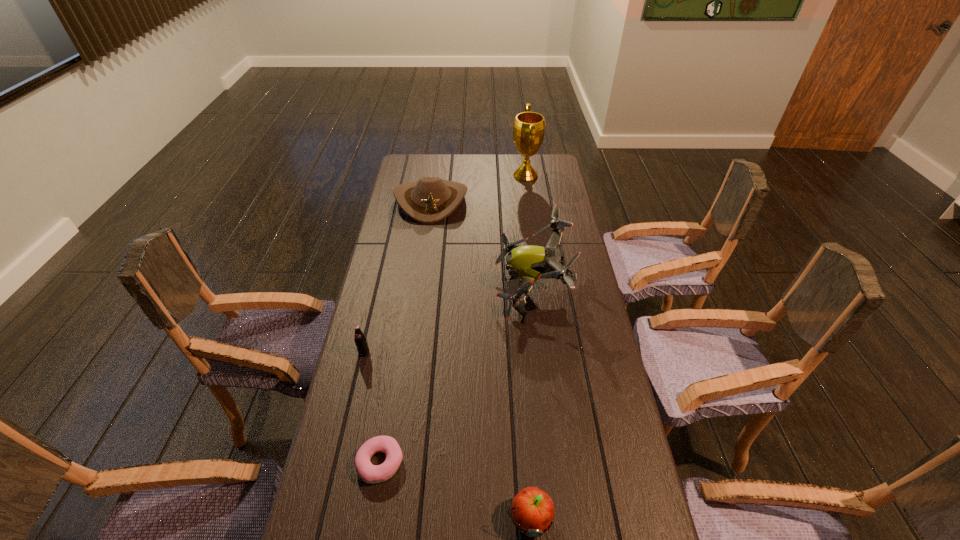
This screenshot has height=540, width=960. I want to click on free spot between the cowboy hat and the pop, so click(x=397, y=276).

The height and width of the screenshot is (540, 960). I want to click on vacant space that's between the award and the pop, so click(444, 264).

I want to click on free space between the cowboy hat and the tallest object, so click(478, 188).

Where is `free space between the pop and the shortest object`? free space between the pop and the shortest object is located at coordinates (372, 408).

What are the coordinates of `free space between the award and the second nearest object` in the screenshot? It's located at (453, 319).

Locate an element on the screen. Image resolution: width=960 pixels, height=540 pixels. the closest object to the cowboy hat is located at coordinates (529, 263).

Choose which object is the fourth nearest neighbor to the nearest object. Please provide its 2D coordinates. Your answer should be formatted as a tuple, i.e. [(x, y)], where the tuple contains the x and y coordinates of a point satisfying the conditions above.

[(430, 200)]

Where is `free space that satisfies the following two spatial constraints: 1. on the front label of the fourth farthest object; 2. on the right side of the pastry`? free space that satisfies the following two spatial constraints: 1. on the front label of the fourth farthest object; 2. on the right side of the pastry is located at coordinates (339, 463).

In order to click on free location that satisfies the following two spatial constraints: 1. on the front-facing side of the tallest object; 2. with a star on the front of the cowboy hat in this screenshot , I will do `click(529, 200)`.

Locate an element on the screen. The width and height of the screenshot is (960, 540). vacant area that satisfies the following two spatial constraints: 1. on the front-facing side of the tallest object; 2. with a star on the front of the cowboy hat is located at coordinates (529, 200).